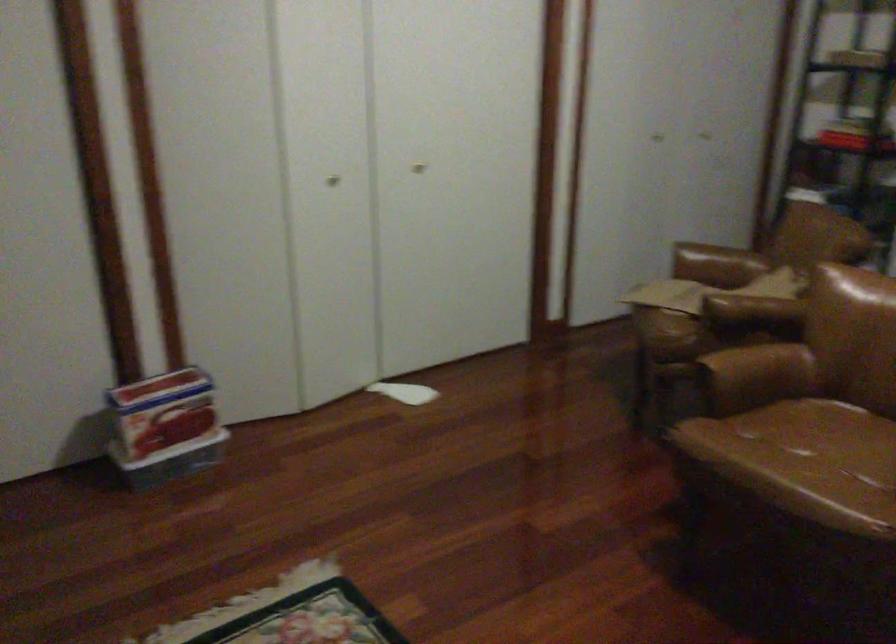
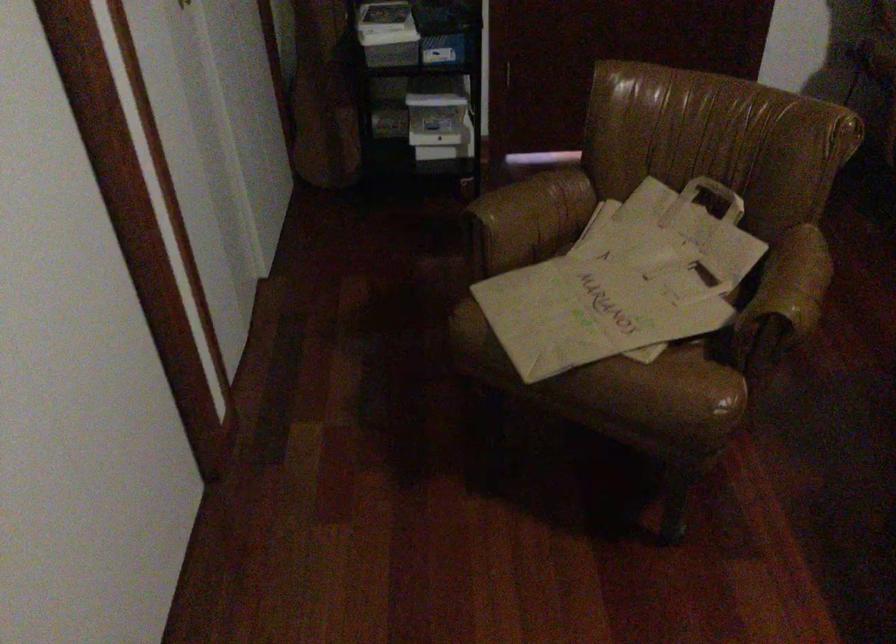
Where in the second image is the point corresponding to point (712, 257) from the first image?

(532, 216)